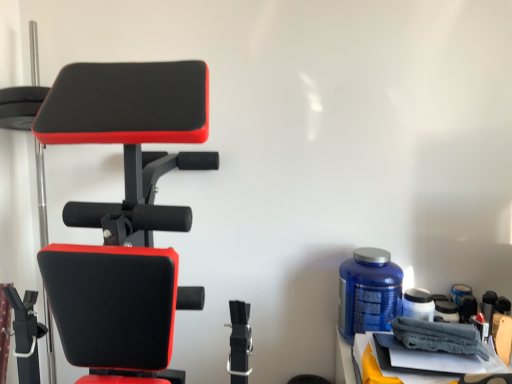
You are a GUI agent. You are given a task and a screenshot of the screen. Output one action in this format:
    pyautogui.click(x=<x>, y=<y>)
    Task: Click on the blue plastic bottle at right
    The height and width of the screenshot is (384, 512).
    Given the screenshot: What is the action you would take?
    pyautogui.click(x=368, y=292)

The width and height of the screenshot is (512, 384). What do you see at coordinates (351, 356) in the screenshot?
I see `gray fabric towel at lower right` at bounding box center [351, 356].

The width and height of the screenshot is (512, 384). What do you see at coordinates (128, 135) in the screenshot?
I see `matte black exercise bench at left` at bounding box center [128, 135].

In order to click on blue plastic bottle at right in this screenshot , I will do `click(368, 292)`.

Considering the relative sizes of matte black exercise bench at left and gray fabric towel at lower right in the image provided, is matte black exercise bench at left taller than gray fabric towel at lower right?

Yes.

From a real-world perspective, who is located lower, matte black exercise bench at left or gray fabric towel at lower right?

From a 3D spatial view, gray fabric towel at lower right is below.

Based on the photo, is matte black exercise bench at left positioned before gray fabric towel at lower right?

Yes, it is in front of gray fabric towel at lower right.

Considering the positions of point (99, 89) and point (482, 360), is point (99, 89) closer or farther from the camera than point (482, 360)?

Point (99, 89).

From the image's perspective, between gray fabric towel at lower right and matte black exercise bench at left, who is located below?

gray fabric towel at lower right.

Considering the relative sizes of gray fabric towel at lower right and matte black exercise bench at left in the image provided, is gray fabric towel at lower right wider than matte black exercise bench at left?

No.

Is gray fabric towel at lower right to the left of matte black exercise bench at left from the viewer's perspective?

In fact, gray fabric towel at lower right is to the right of matte black exercise bench at left.

Is gray fabric towel at lower right oriented away from matte black exercise bench at left?

No, gray fabric towel at lower right's orientation is not away from matte black exercise bench at left.

From the image's perspective, does matte black exercise bench at left appear lower than blue plastic bottle at right?

No, from the image's perspective, matte black exercise bench at left is not below blue plastic bottle at right.

Image resolution: width=512 pixels, height=384 pixels. Find the location of `bottle behind the matte black exercise bench at left`. bottle behind the matte black exercise bench at left is located at coordinates (368, 292).

From a real-world perspective, is matte black exercise bench at left on blue plastic bottle at right?

Yes.

How far apart are matte black exercise bench at left and blue plastic bottle at right?

matte black exercise bench at left and blue plastic bottle at right are 27.51 inches apart from each other.

From a real-world perspective, is gray fabric towel at lower right physically above blue plastic bottle at right?

No, from a real-world perspective, gray fabric towel at lower right is not above blue plastic bottle at right.

Between point (361, 376) and point (364, 332), which one is positioned behind?

The point (364, 332) is more distant.

At what (x,y) coordinates should I click in order to perform the action: click on bottle to the left of gray fabric towel at lower right. Please return your answer as a coordinate pair (x, y). The height and width of the screenshot is (384, 512). Looking at the image, I should click on (368, 292).

In the scene shown: Is blue plastic bottle at right positioned behind matte black exercise bench at left?

Yes.

From the picture: From the image's perspective, which is above, blue plastic bottle at right or matte black exercise bench at left?

matte black exercise bench at left appears higher in the image.

Which point is more forward, (375,286) or (56,140)?

The point (56,140) is closer to the camera.

Based on their positions, is blue plastic bottle at right located to the left or right of matte black exercise bench at left?

Based on their positions, blue plastic bottle at right is located to the right of matte black exercise bench at left.

Is blue plastic bottle at right spatially inside gray fabric towel at lower right, or outside of it?

The correct answer is: outside.

Is blue plastic bottle at right further to camera compared to gray fabric towel at lower right?

Yes, it is.

This screenshot has width=512, height=384. In the image, there is a gray fabric towel at lower right. Find the location of `bottle above it (from the image's perspective)`. bottle above it (from the image's perspective) is located at coordinates (368, 292).

Can you confirm if blue plastic bottle at right is taller than gray fabric towel at lower right?

Indeed, blue plastic bottle at right has a greater height compared to gray fabric towel at lower right.

Where is `table behind the matte black exercise bench at left`? table behind the matte black exercise bench at left is located at coordinates (351, 356).

Where is `table below the matte black exercise bench at left (from a real-world perspective)`? The image size is (512, 384). table below the matte black exercise bench at left (from a real-world perspective) is located at coordinates (351, 356).

Based on the photo, estimate the real-world distances between objects in this image. Which object is closer to gray fabric towel at lower right, blue plastic bottle at right or matte black exercise bench at left?

Among the two, blue plastic bottle at right is located nearer to gray fabric towel at lower right.

Estimate the real-world distances between objects in this image. Which object is closer to blue plastic bottle at right, matte black exercise bench at left or gray fabric towel at lower right?

The object closer to blue plastic bottle at right is gray fabric towel at lower right.

Which object lies further to the anchor point blue plastic bottle at right, gray fabric towel at lower right or matte black exercise bench at left?

The object further to blue plastic bottle at right is matte black exercise bench at left.

When comparing their distances from gray fabric towel at lower right, does matte black exercise bench at left or blue plastic bottle at right seem further?

Among the two, matte black exercise bench at left is located further to gray fabric towel at lower right.

In the scene shown: From the image, which object appears to be farther from matte black exercise bench at left, blue plastic bottle at right or gray fabric towel at lower right?

The object further to matte black exercise bench at left is gray fabric towel at lower right.

In the scene shown: Based on their spatial positions, is gray fabric towel at lower right or blue plastic bottle at right further from matte black exercise bench at left?

Based on the image, gray fabric towel at lower right appears to be further to matte black exercise bench at left.

Find the location of a particular element. bottle between matte black exercise bench at left and gray fabric towel at lower right from left to right is located at coordinates (368, 292).